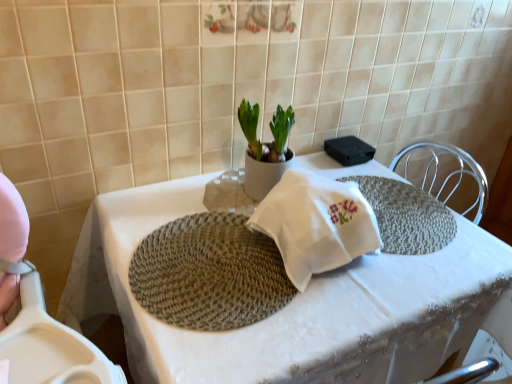
This screenshot has height=384, width=512. Describe the element at coordinates (291, 304) in the screenshot. I see `white woven placemat at center` at that location.

Image resolution: width=512 pixels, height=384 pixels. I want to click on rattan placemat at center, so click(209, 273).

The height and width of the screenshot is (384, 512). What are the coordinates of `white ceramic pot at center` in the screenshot? It's located at (265, 149).

In the image, is rattan placemat at center positioned in front of or behind white woven placemat at center?

Clearly, rattan placemat at center is behind white woven placemat at center.

From the image's perspective, which one is positioned higher, rattan placemat at center or white woven placemat at center?

rattan placemat at center.

Which is more to the left, rattan placemat at center or white woven placemat at center?

rattan placemat at center.

Is rattan placemat at center situated inside white woven placemat at center or outside?

The correct answer is: inside.

Can you tell me how much white ceramic pot at center and rattan placemat at center differ in facing direction?

There is a 0.184-degree angle between the facing directions of white ceramic pot at center and rattan placemat at center.

Between point (271, 171) and point (234, 308), which one is positioned behind?

The point (271, 171) is more distant.

Is white ceramic pot at center looking in the opposite direction of rattan placemat at center?

No.

Does white ceramic pot at center have a smaller size compared to rattan placemat at center?

No.

Between white woven placemat at center and white ceramic pot at center, which one has smaller size?

With smaller size is white ceramic pot at center.

How distant is white woven placemat at center from white ceramic pot at center?

The distance of white woven placemat at center from white ceramic pot at center is 14.59 inches.

Considering their positions, is white woven placemat at center located in front of or behind white ceramic pot at center?

In the image, white woven placemat at center appears in front of white ceramic pot at center.

Is rattan placemat at center facing towards white ceramic pot at center?

No, rattan placemat at center is not turned towards white ceramic pot at center.

This screenshot has height=384, width=512. Find the location of `houseplant behind the rattan placemat at center`. houseplant behind the rattan placemat at center is located at coordinates (265, 149).

Is rattan placemat at center located outside white ceramic pot at center?

That's correct, rattan placemat at center is outside of white ceramic pot at center.

Considering the relative sizes of rattan placemat at center and white ceramic pot at center in the image provided, is rattan placemat at center taller than white ceramic pot at center?

No.

From the image's perspective, between white woven placemat at center and rattan placemat at center, which one is located above?

rattan placemat at center, from the image's perspective.

Which object is closer to the camera, white woven placemat at center or rattan placemat at center?

white woven placemat at center is more forward.

Can you confirm if white woven placemat at center is positioned to the left of rattan placemat at center?

No.

From a real-world perspective, does white ceramic pot at center sit lower than white woven placemat at center?

No, from a real-world perspective, white ceramic pot at center is not under white woven placemat at center.

Considering the relative positions of white ceramic pot at center and white woven placemat at center in the image provided, is white ceramic pot at center to the left or to the right of white woven placemat at center?

In the image, white ceramic pot at center appears on the left side of white woven placemat at center.

Can you confirm if white ceramic pot at center is smaller than white woven placemat at center?

Indeed, white ceramic pot at center has a smaller size compared to white woven placemat at center.

This screenshot has width=512, height=384. In order to click on table that appears on the right of white ceramic pot at center in this screenshot , I will do `click(291, 304)`.

Find the location of a particular element. The image size is (512, 384). table that appears below the rattan placemat at center (from the image's perspective) is located at coordinates (291, 304).

Find the location of `houseplant located on the right of rattan placemat at center`. houseplant located on the right of rattan placemat at center is located at coordinates (265, 149).

Looking at the image, which one is located closer to white ceramic pot at center, white woven placemat at center or rattan placemat at center?

rattan placemat at center.

From the image, which object appears to be nearer to white ceramic pot at center, rattan placemat at center or white woven placemat at center?

rattan placemat at center is closer to white ceramic pot at center.

Looking at the image, which one is located closer to white woven placemat at center, rattan placemat at center or white ceramic pot at center?

rattan placemat at center lies closer to white woven placemat at center than the other object.

Looking at the image, which one is located further to rattan placemat at center, white ceramic pot at center or white woven placemat at center?

white ceramic pot at center lies further to rattan placemat at center than the other object.

Considering their positions, is white woven placemat at center positioned closer to rattan placemat at center than white ceramic pot at center?

The object closer to rattan placemat at center is white woven placemat at center.

Which object lies further to the anchor point white woven placemat at center, white ceramic pot at center or rattan placemat at center?

Based on the image, white ceramic pot at center appears to be further to white woven placemat at center.

Image resolution: width=512 pixels, height=384 pixels. I want to click on mat located between white woven placemat at center and white ceramic pot at center in the depth direction, so click(x=209, y=273).